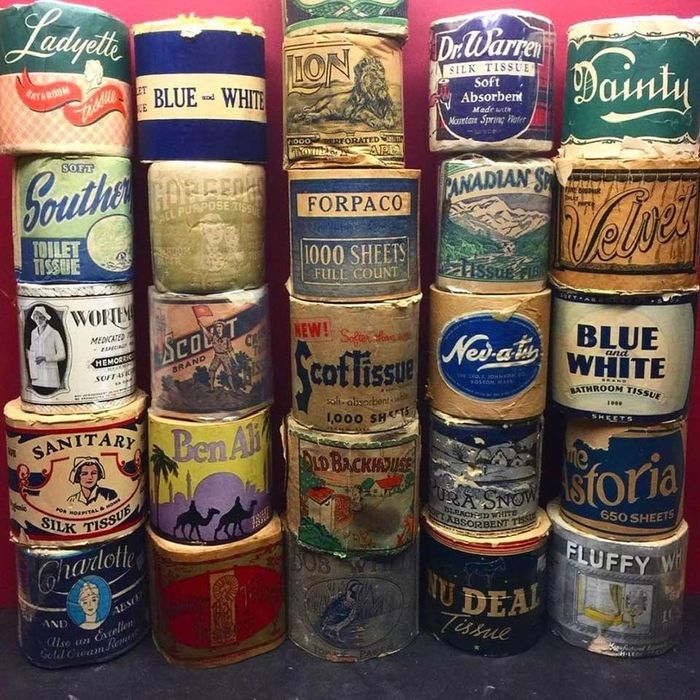
Image resolution: width=700 pixels, height=700 pixels. Find the location of `wall`. wall is located at coordinates (413, 24).